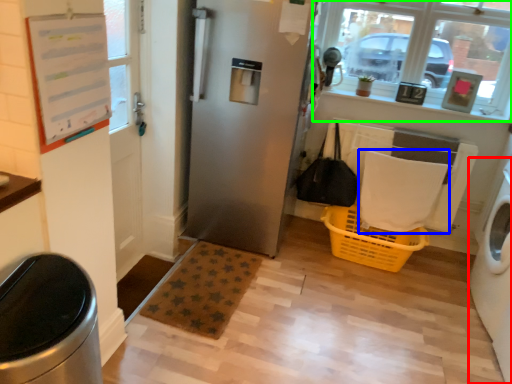
Question: Which is farther away from washing machine (highlighted by a red box)? blanket (highlighted by a blue box) or window (highlighted by a green box)?

Choices:
 (A) blanket
 (B) window

Answer: (B)